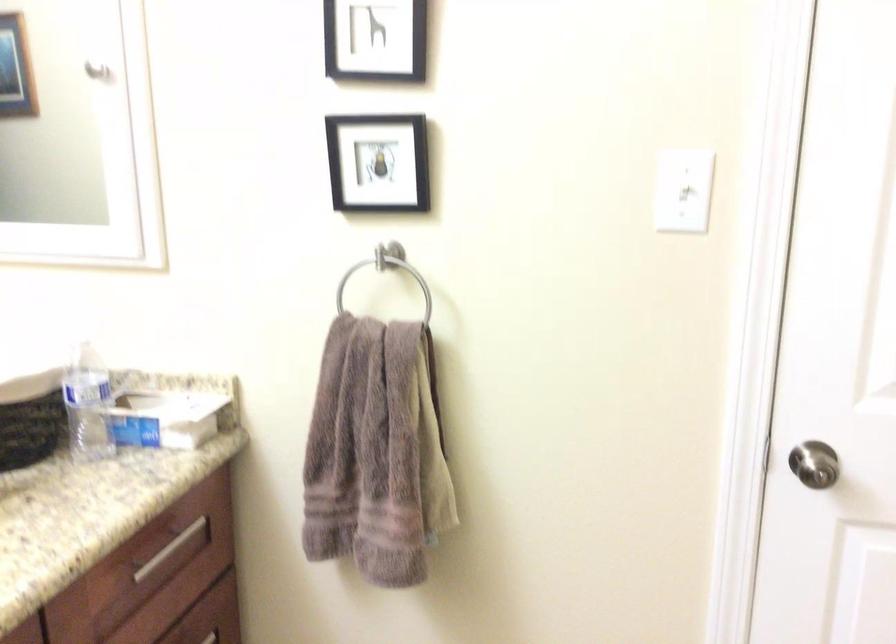
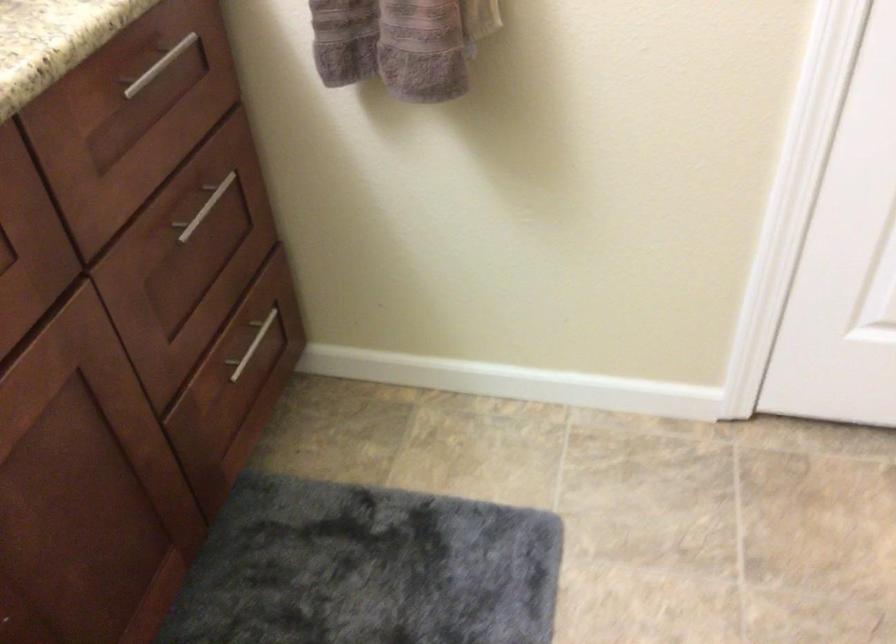
The images are taken continuously from a first-person perspective. In which direction are you moving?

The movement direction of the cameraman is left, forward.